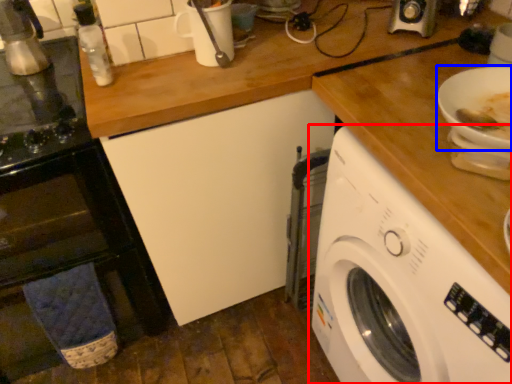
Question: Which point is closer to the camera, washing machine (highlighted by a red box) or bowl (highlighted by a blue box)?

Choices:
 (A) washing machine
 (B) bowl

Answer: (A)